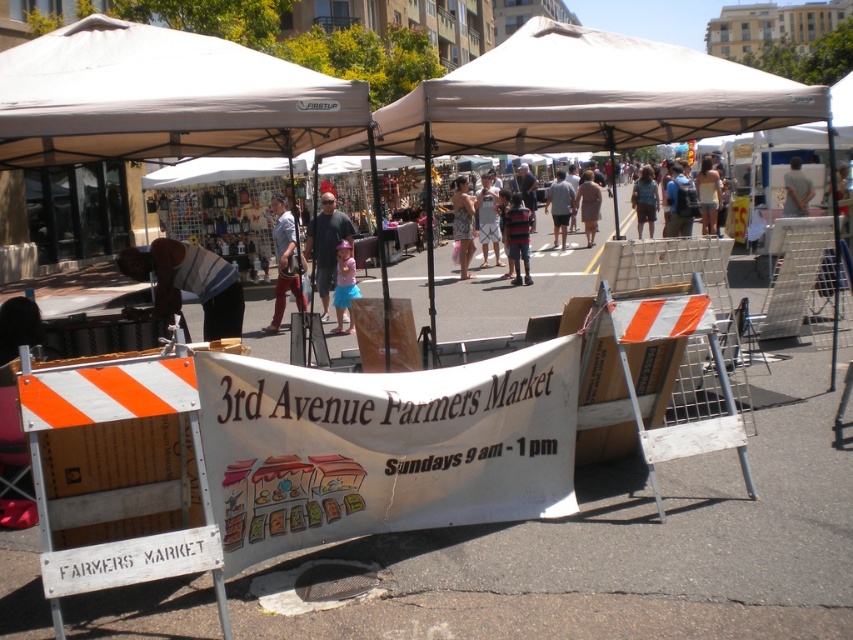
Question: Which object is closer to the camera taking this photo?

Choices:
 (A) floral dress at center
 (B) matte white shirt at center
 (C) denim shorts at center

Answer: (B)

Question: Is beige fabric canopy at upper center smaller than striped fabric at center?

Choices:
 (A) yes
 (B) no

Answer: (B)

Question: Does beige fabric tent at center appear under matte white shirt at center?

Choices:
 (A) no
 (B) yes

Answer: (A)

Question: Which object appears farthest from the camera in this image?

Choices:
 (A) dark blue jeans at center
 (B) gray cotton shirt at center
 (C) striped fabric at center

Answer: (B)

Question: Does white fabric canopy at upper left have a smaller size compared to floral dress at center?

Choices:
 (A) yes
 (B) no

Answer: (A)

Question: Considering the real-world distances, which object is farthest from the beige fabric tent at center?

Choices:
 (A) matte gray shirt at center
 (B) striped fabric at center
 (C) light brown fabric dress at center

Answer: (C)